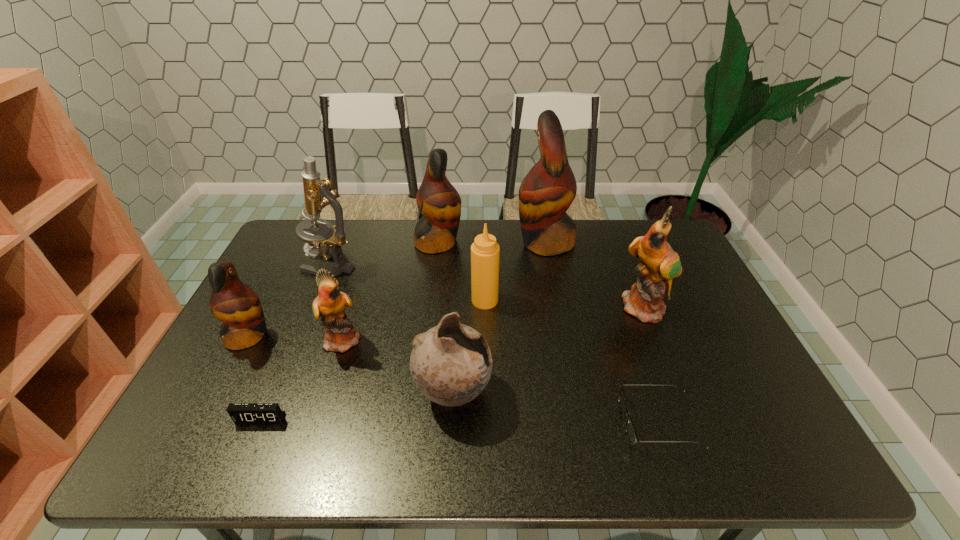
Locate an element on the screen. vacant space at the near left corner of the desktop is located at coordinates tap(173, 437).

The image size is (960, 540). I want to click on free location at the near right corner of the desktop, so click(783, 448).

The width and height of the screenshot is (960, 540). I want to click on empty space that is in between the black spectacles and the microscope, so click(494, 343).

Locate an element on the screen. This screenshot has width=960, height=540. empty space that is in between the alarm clock and the nearest red parrot is located at coordinates tap(254, 377).

Locate an element on the screen. free space between the second biggest red parrot and the right green parrot is located at coordinates (542, 275).

Identify the location of vacant space that is in between the leftmost parrot and the condiment. coord(367,318).

At what (x,y) coordinates should I click in order to perform the action: click on free spot between the alarm clock and the microscope. Please return your answer as a coordinate pair (x, y). The height and width of the screenshot is (540, 960). Looking at the image, I should click on (296, 341).

The width and height of the screenshot is (960, 540). I want to click on unoccupied position between the pottery and the alarm clock, so click(357, 405).

The width and height of the screenshot is (960, 540). What are the coordinates of `free space between the alarm clock and the tan condiment` in the screenshot? It's located at (372, 359).

You are a GUI agent. You are given a task and a screenshot of the screen. Output one action in this format:
    pyautogui.click(x=<x>, y=<y>)
    Task: Click on the free spot between the smallest red parrot and the alarm clock
    
    Given the screenshot: What is the action you would take?
    [x=254, y=377]